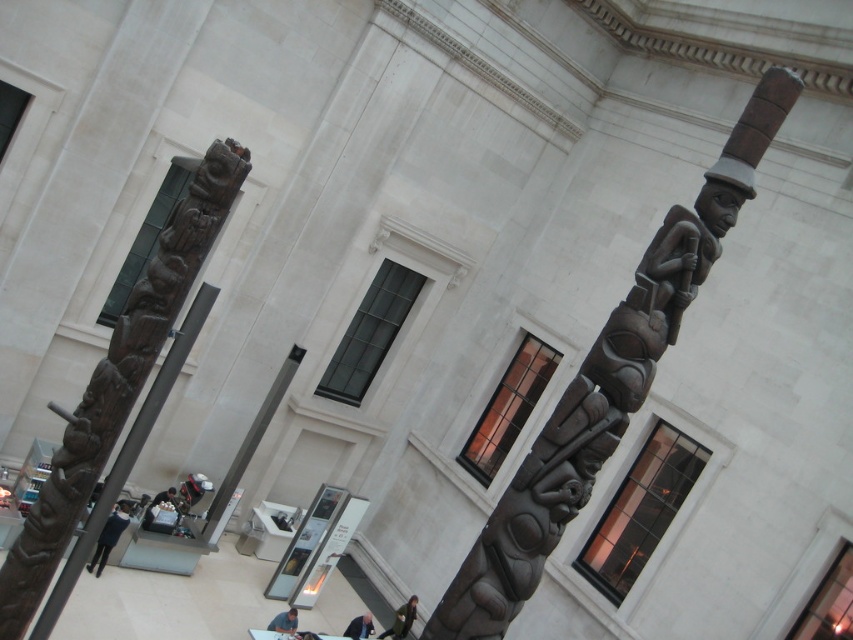
You are a security guard in the museum and need to check the distance between the dark blue jeans at lower left and the dark brown leather jacket at lower center. Can you confirm if the distance is more than 20 feet?

The dark blue jeans at lower left is 20.83 feet away from the dark brown leather jacket at lower center, so yes, the distance is more than 20 feet.

From the picture: You are a security guard in the museum and need to place a small fire extinguisher between the dark blue jeans at lower left and the dark brown leather jacket at lower left. Can the space between them accommodate the fire extinguisher?

The dark blue jeans at lower left is larger in size than the dark brown leather jacket at lower left, so the space between them may be sufficient to place the fire extinguisher.

You are standing in the grand building and notice two items on the floor. The dark blue jeans at lower left and the dark brown leather jacket at lower center. Which item is placed higher up in the scene?

The dark blue jeans at lower left is positioned over the dark brown leather jacket at lower center, so the dark blue jeans at lower left is placed higher up in the scene.